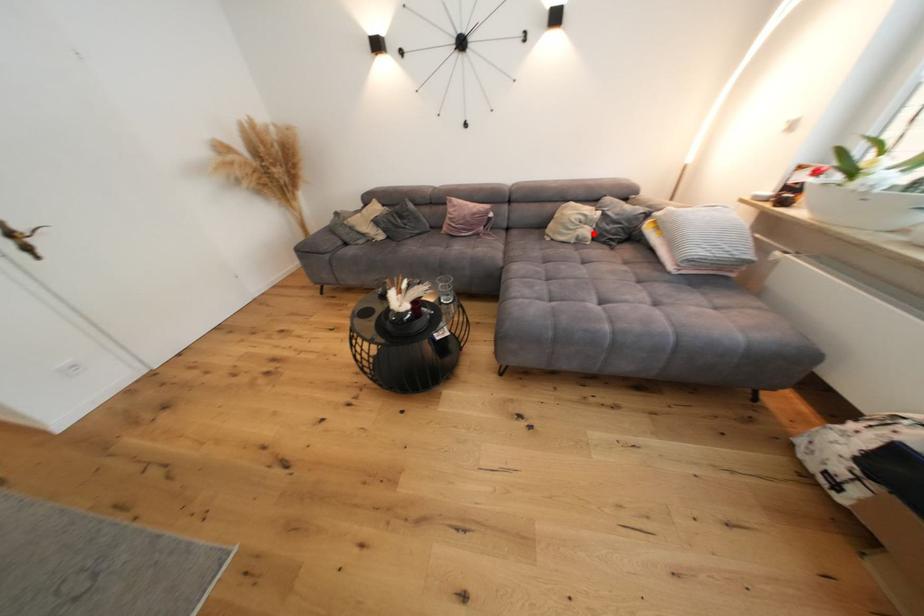
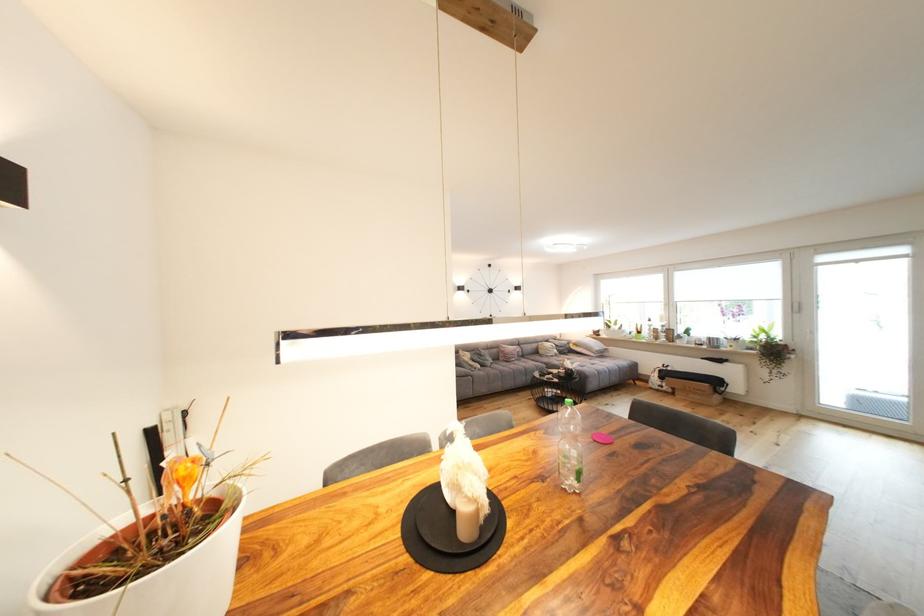
Question: I am providing you with two images of the same scene from different viewpoints. Given a red point in image1, look at the same physical point in image2. Is it:

Choices:
 (A) Closer to the viewpoint
 (B) Farther from the viewpoint

Answer: (B)